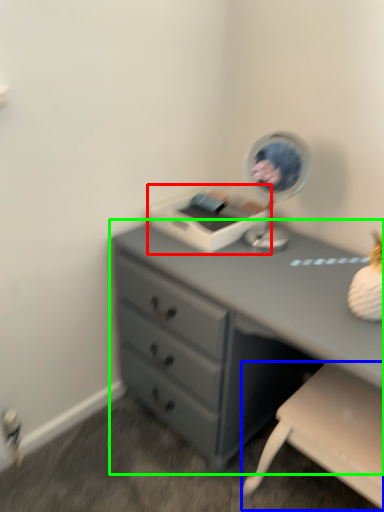
Question: Which object is positioned closest to printer (highlighted by a red box)? Select from swivel chair (highlighted by a blue box) and chest of drawers (highlighted by a green box).

Choices:
 (A) swivel chair
 (B) chest of drawers

Answer: (B)